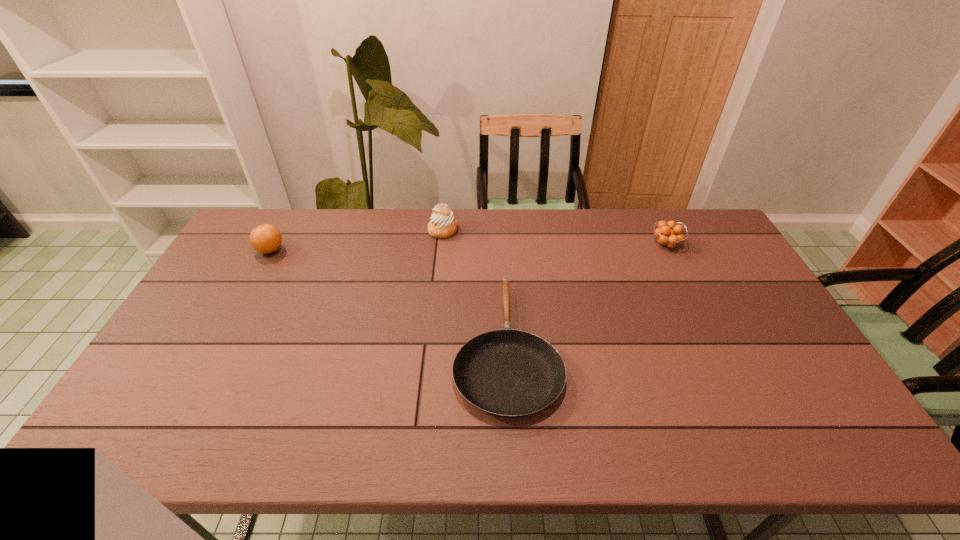
Image resolution: width=960 pixels, height=540 pixels. I want to click on the third object from right to left, so click(x=442, y=225).

Where is `the left orange fruit`? The height and width of the screenshot is (540, 960). the left orange fruit is located at coordinates (266, 238).

Find the location of `the right orange fruit`. the right orange fruit is located at coordinates (668, 234).

Where is `the rightmost object`? the rightmost object is located at coordinates (668, 234).

Locate an element on the screen. The height and width of the screenshot is (540, 960). the nearest object is located at coordinates (508, 373).

Locate an element on the screen. the shortest object is located at coordinates (508, 373).

In order to click on vacant space located on the left of the third object from right to left in this screenshot , I will do `click(352, 230)`.

You are a GUI agent. You are given a task and a screenshot of the screen. Output one action in this format:
    pyautogui.click(x=<x>, y=<y>)
    Task: Click on the free space located 0.390m on the front of the left orange fruit
    
    Given the screenshot: What is the action you would take?
    pyautogui.click(x=214, y=355)

Locate an element on the screen. The width and height of the screenshot is (960, 540). free space located on the left of the shorter orange fruit is located at coordinates (592, 245).

The width and height of the screenshot is (960, 540). In order to click on free region located on the left of the frying pan in this screenshot , I will do `click(320, 345)`.